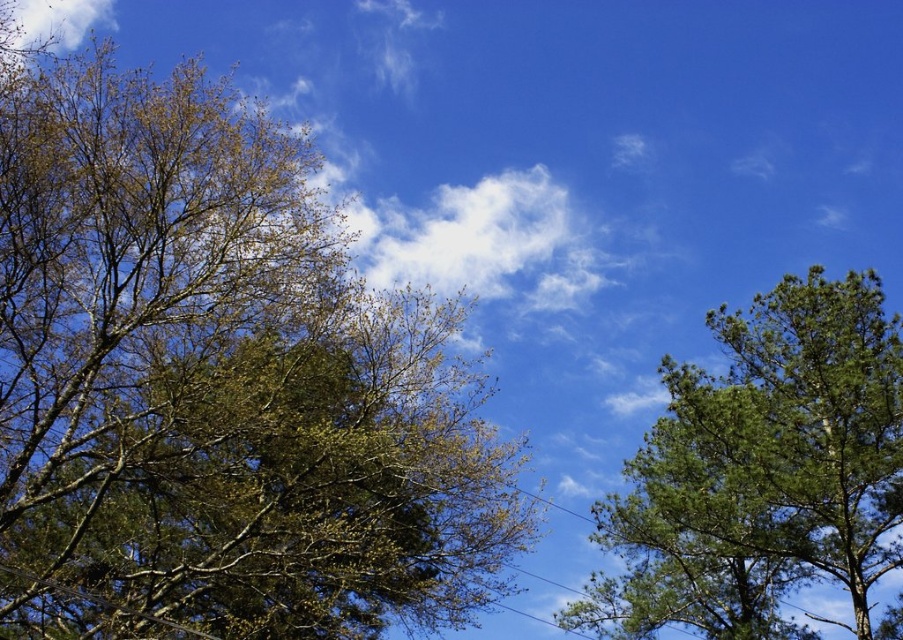
You are standing in the middle of the scene and want to walk towards the nearest tree. Which tree should you head towards, the green leafy tree at left or the green textured tree at right?

You should head towards the green leafy tree at left because it is closer to you than the green textured tree at right.

You are standing in the middle of the outdoor scene looking towards the two points marked in the image. Which point, point (304, 632) or point (590, 588), is closer to you?

Point (304, 632) is closer to you because it is in front of point (590, 588).

You are planning to plant a new tree in your garden. You have two options based on the image you see. The green leafy tree at left and the green textured tree at right. Which tree has a wider canopy?

The green leafy tree at left has a wider canopy than the green textured tree at right, as its width surpasses the other.